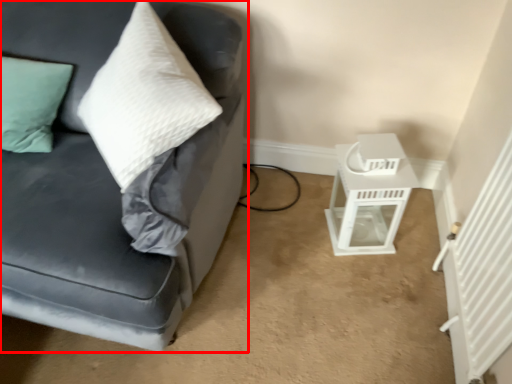
Question: Observing the image, what is the correct spatial positioning of studio couch (annotated by the red box) in reference to table?

Choices:
 (A) right
 (B) left

Answer: (B)